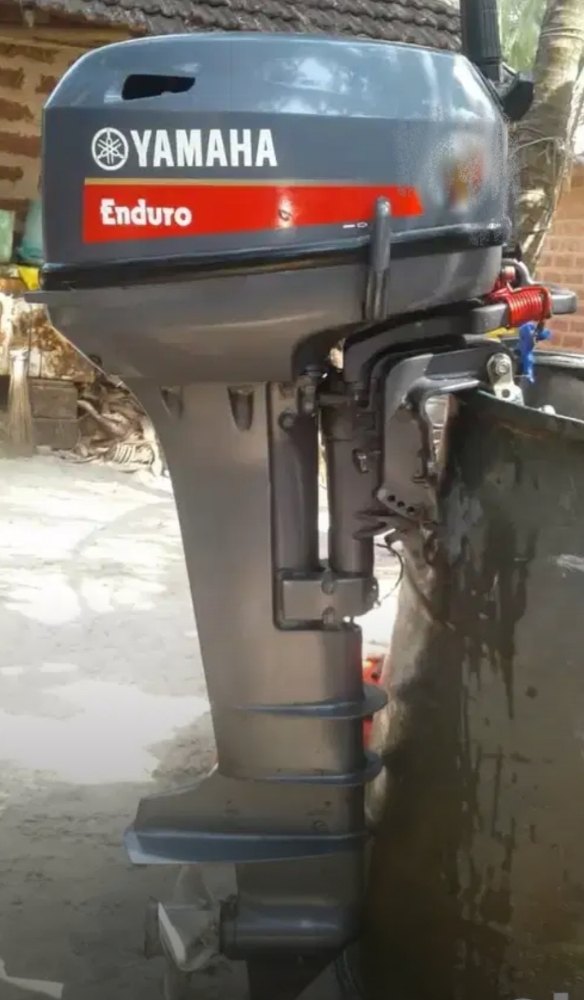
Locate an element on the screen. This screenshot has width=584, height=1000. cable is located at coordinates (524, 304).